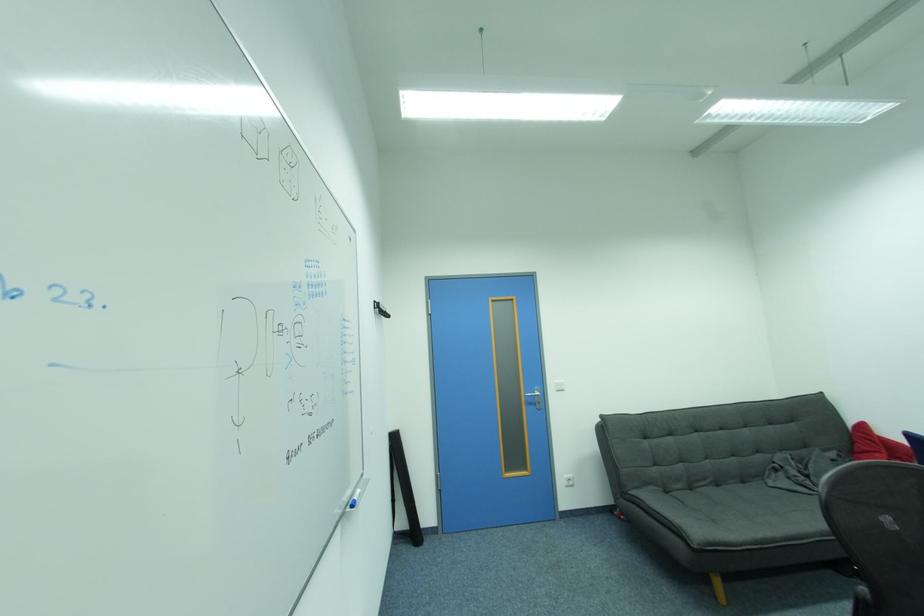
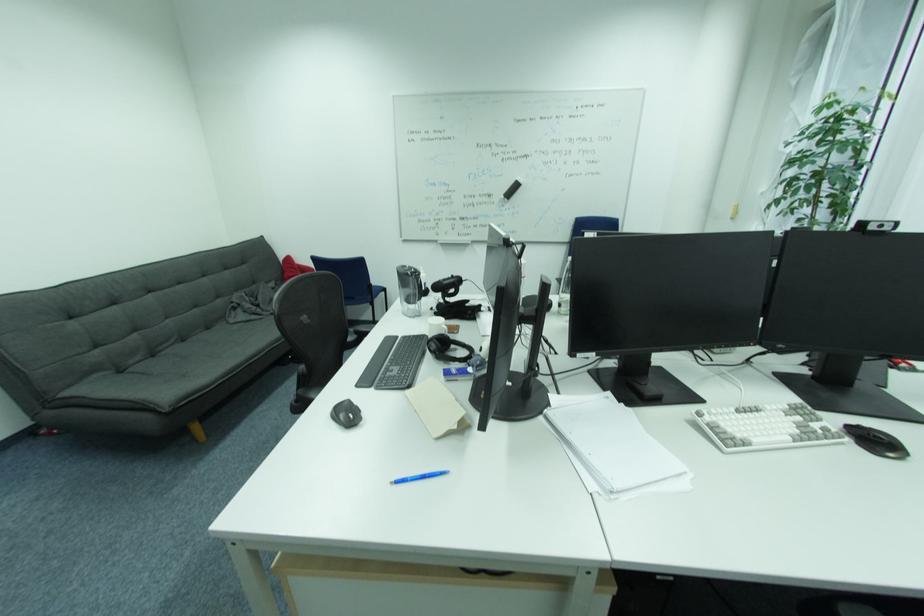
Based on the continuous images, in which direction is the camera rotating?

The camera's rotation is toward right-down.